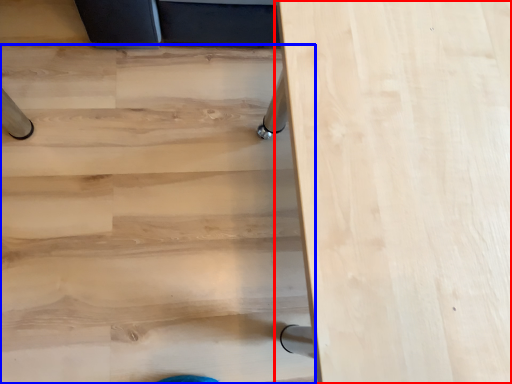
Question: Among these objects, which one is nearest to the camera, table (highlighted by a red box) or stairwell (highlighted by a blue box)?

Choices:
 (A) table
 (B) stairwell

Answer: (A)